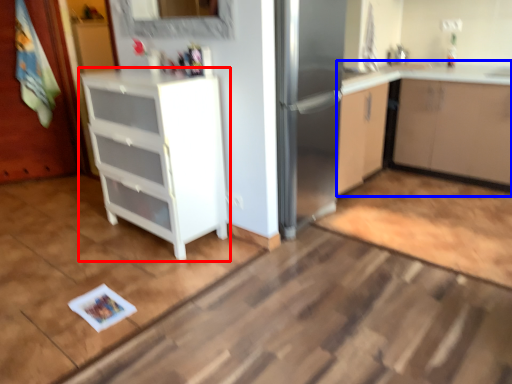
Question: Which point is closer to the camera, cabinetry (highlighted by a red box) or cabinetry (highlighted by a blue box)?

Choices:
 (A) cabinetry
 (B) cabinetry

Answer: (A)